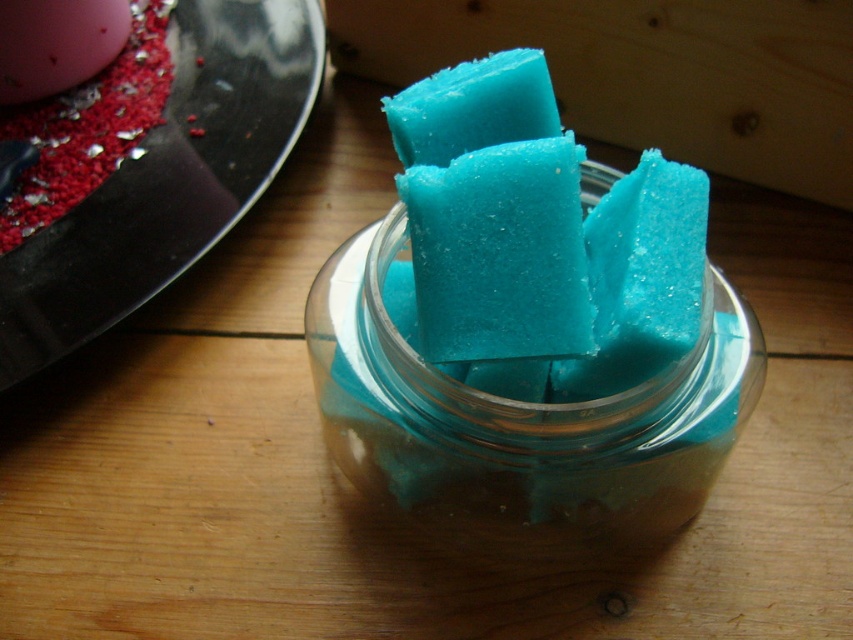
Between blue translucent soap at center and teal matte soap at center, which one is positioned lower?

Positioned lower is blue translucent soap at center.

Is point (461, 305) closer to camera compared to point (498, 52)?

Yes.

The image size is (853, 640). Identify the location of blue translucent soap at center. (498, 253).

Where is `blue translucent soap at center`? blue translucent soap at center is located at coordinates (498, 253).

Between transparent glass jar at center and blue translucent soap at center, which one has more height?

transparent glass jar at center

Find the location of a particular element. This screenshot has height=640, width=853. transparent glass jar at center is located at coordinates (519, 422).

Between point (363, 460) and point (514, 173), which one is positioned behind?

Positioned behind is point (363, 460).

Find the location of a particular element. The width and height of the screenshot is (853, 640). transparent glass jar at center is located at coordinates (519, 422).

Who is lower down, transparent glass jar at center or teal matte soap at center?

transparent glass jar at center is lower down.

Can you confirm if transparent glass jar at center is bigger than teal matte soap at center?

Correct, transparent glass jar at center is larger in size than teal matte soap at center.

Does point (422, 429) come closer to viewer compared to point (463, 84)?

Yes, point (422, 429) is in front of point (463, 84).

Identify the location of transparent glass jar at center. (519, 422).